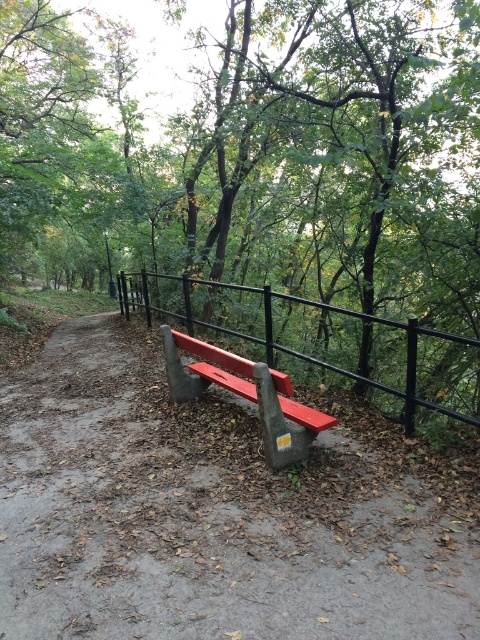
Does concrete bench at center come behind smooth red bench at center?

That is False.

Does point (74, 577) come farther from viewer compared to point (202, 371)?

No, it is in front of (202, 371).

Describe the element at coordinates (213, 513) in the screenshot. I see `concrete bench at center` at that location.

What are the coordinates of `concrete bench at center` in the screenshot? It's located at (213, 513).

The width and height of the screenshot is (480, 640). Describe the element at coordinates (245, 394) in the screenshot. I see `smooth red bench at center` at that location.

Between smooth red bench at center and smooth metal bench at center, which one has more height?

With more height is smooth red bench at center.

Describe the element at coordinates (245, 394) in the screenshot. The image size is (480, 640). I see `smooth red bench at center` at that location.

The height and width of the screenshot is (640, 480). I want to click on smooth red bench at center, so click(x=245, y=394).

Can you confirm if green leafy tree at center is positioned above smooth metal bench at center?

Yes.

Between point (229, 253) and point (399, 396), which one is positioned in front?

Point (399, 396) is in front.

The image size is (480, 640). Identify the location of green leafy tree at center. (264, 182).